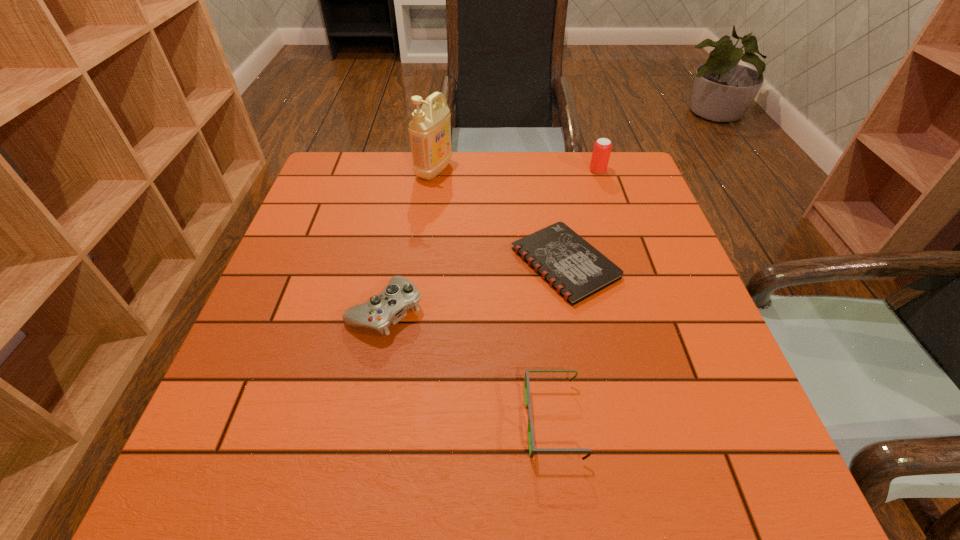
Where is `the tallest object`? The width and height of the screenshot is (960, 540). the tallest object is located at coordinates (430, 130).

Where is `the rightmost object`? the rightmost object is located at coordinates (602, 148).

Find the location of `beer can`. beer can is located at coordinates (602, 148).

This screenshot has height=540, width=960. In order to click on control in this screenshot , I will do `click(390, 306)`.

I want to click on spectacles, so click(x=532, y=449).

The height and width of the screenshot is (540, 960). Identify the location of the nearest object. (532, 449).

Image resolution: width=960 pixels, height=540 pixels. What are the coordinates of `the shortest object` in the screenshot? It's located at (574, 268).

Where is `vacant space located 0.380m on the front of the detergent`? This screenshot has width=960, height=540. vacant space located 0.380m on the front of the detergent is located at coordinates click(420, 282).

I want to click on free region located 0.260m on the left of the second tallest object, so point(500,171).

Locate an element on the screen. This screenshot has width=960, height=540. vacant space located on the back of the third shortest object is located at coordinates point(409,185).